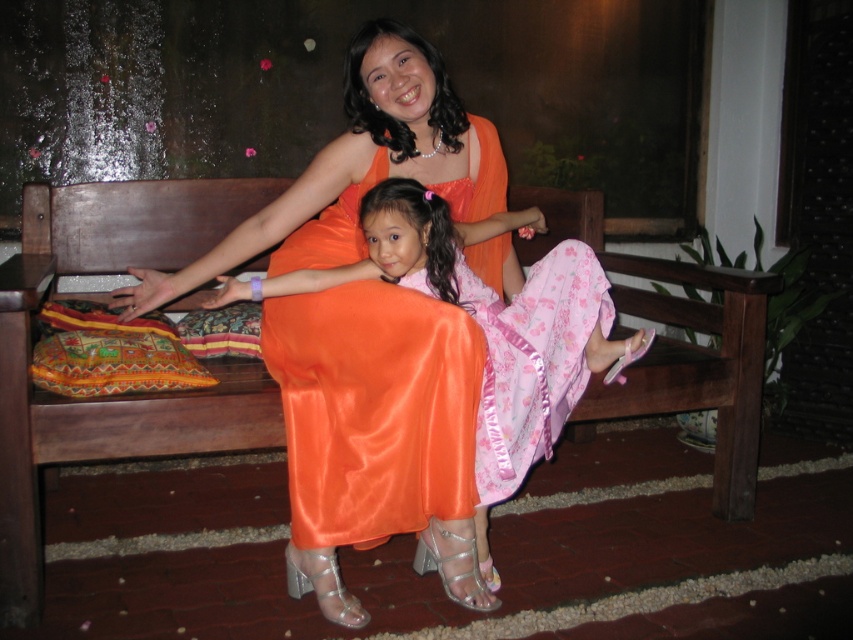
Based on the photo, can you confirm if wooden bench at center is positioned below shiny orange dress at center?

Yes, wooden bench at center is below shiny orange dress at center.

Is point (196, 205) positioned before point (415, 301)?

No, it is behind (415, 301).

Does point (759, 323) come closer to viewer compared to point (287, 465)?

No, (759, 323) is further to viewer.

Where is `wooden bench at center`? wooden bench at center is located at coordinates (113, 396).